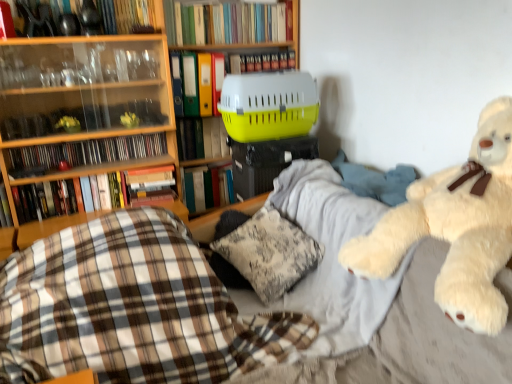
The width and height of the screenshot is (512, 384). In order to click on free spot above hardcover book at left, placed as the 8th book when sorted from top to bottom (from a real-world perspective) in this screenshot , I will do (x=109, y=167).